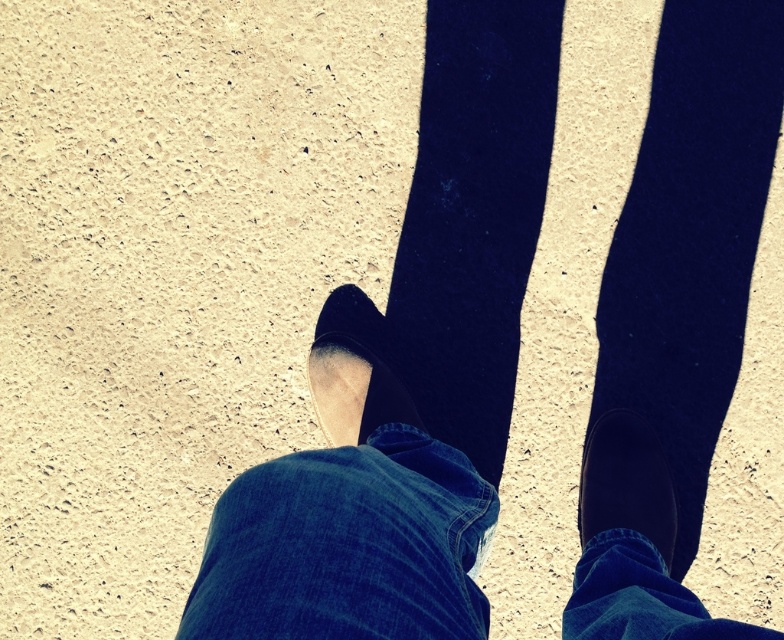
Question: Is denim at center bigger than black suede shoe at lower right?

Choices:
 (A) yes
 (B) no

Answer: (A)

Question: Is denim at center below suede black shoe at center?

Choices:
 (A) yes
 (B) no

Answer: (A)

Question: Estimate the real-world distances between objects in this image. Which object is closer to the black suede shoe at lower right?

Choices:
 (A) denim at center
 (B) suede black shoe at center

Answer: (A)

Question: Based on their relative distances, which object is farther from the black suede shoe at lower right?

Choices:
 (A) denim at center
 (B) suede black shoe at center

Answer: (B)

Question: Which object is positioned closest to the suede black shoe at center?

Choices:
 (A) black suede shoe at lower right
 (B) denim at center

Answer: (A)

Question: Can you confirm if denim at center is bigger than suede black shoe at center?

Choices:
 (A) no
 (B) yes

Answer: (B)